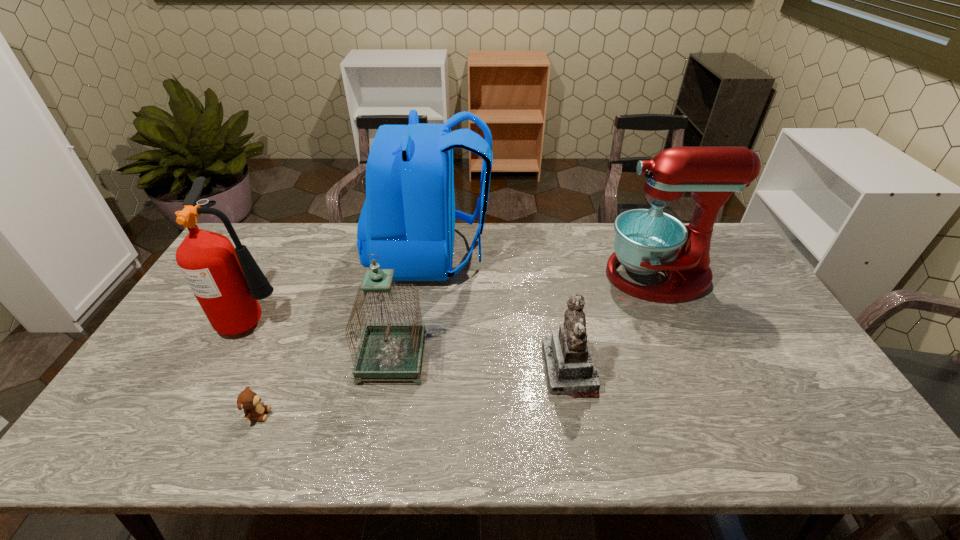
Identify the location of free space between the birdcage and the shortest object. This screenshot has height=540, width=960. (325, 387).

Find the location of a particular element. The width and height of the screenshot is (960, 540). free space between the backpack and the fire extinguisher is located at coordinates (343, 286).

At what (x,y) coordinates should I click in order to perform the action: click on vacant space that is in between the teddy bear and the backpack. Please return your answer as a coordinate pair (x, y). The image size is (960, 540). Looking at the image, I should click on (345, 334).

Where is `vacant area that lies between the mixer and the birdcage`? The height and width of the screenshot is (540, 960). vacant area that lies between the mixer and the birdcage is located at coordinates (525, 318).

Locate an element on the screen. The height and width of the screenshot is (540, 960). free spot between the leftmost object and the birdcage is located at coordinates (324, 339).

Where is `vacant space that's between the third shortest object and the mixer`? vacant space that's between the third shortest object and the mixer is located at coordinates (525, 318).

Image resolution: width=960 pixels, height=540 pixels. I want to click on vacant space that is in between the third shortest object and the leftmost object, so click(x=324, y=339).

Locate an element on the screen. empty space between the mixer and the birdcage is located at coordinates (525, 318).

Find the location of a particular element. The height and width of the screenshot is (540, 960). object that is the second nearest to the mixer is located at coordinates (408, 218).

Identify which object is the fifth nearest to the second object from left to right. Please provide its 2D coordinates. Your answer should be formatted as a tuple, i.e. [(x, y)], where the tuple contains the x and y coordinates of a point satisfying the conditions above.

[(647, 241)]